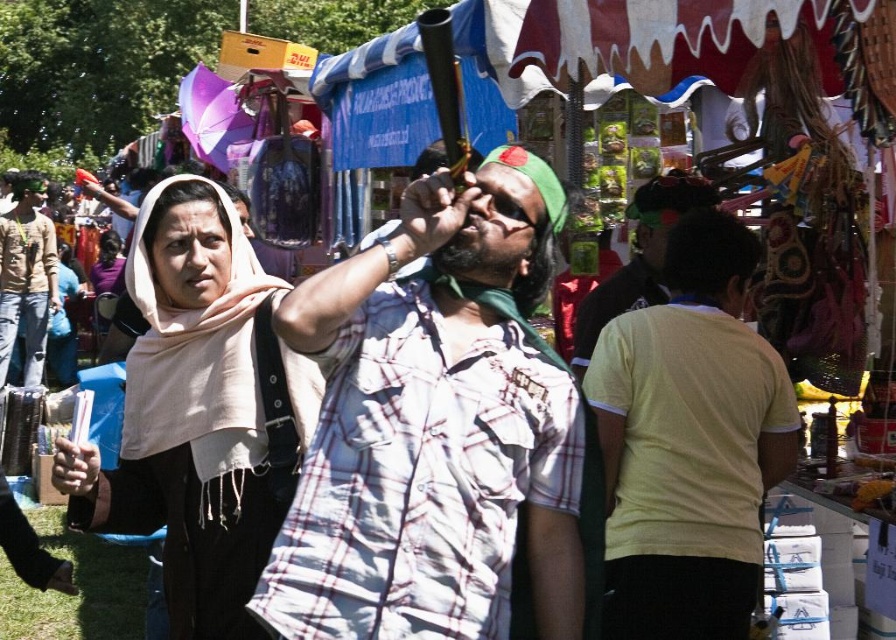
You are a photographer at the market and want to capture both the beige fabric scarf at left and the light brown cotton shirt at left in a single frame. Which item should you focus on first to ensure both are in the shot?

The beige fabric scarf at left is smaller than the light brown cotton shirt at left, so focusing on the larger light brown cotton shirt at left first will help ensure both items are captured in the frame.

You are at the market and see the white checkered shirt at center. Can you determine its exact location using the coordinate system provided?

The white checkered shirt at center is located at point (435,426).